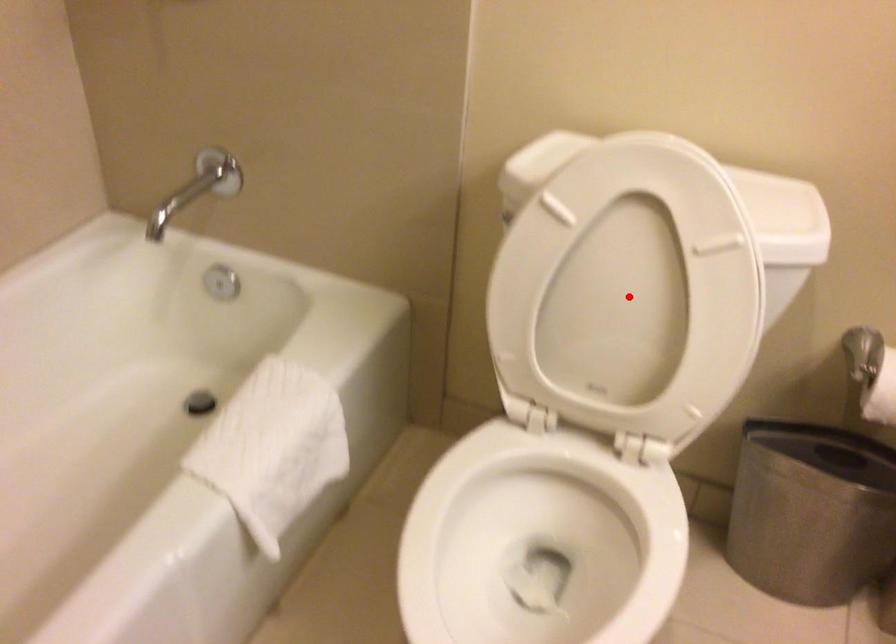
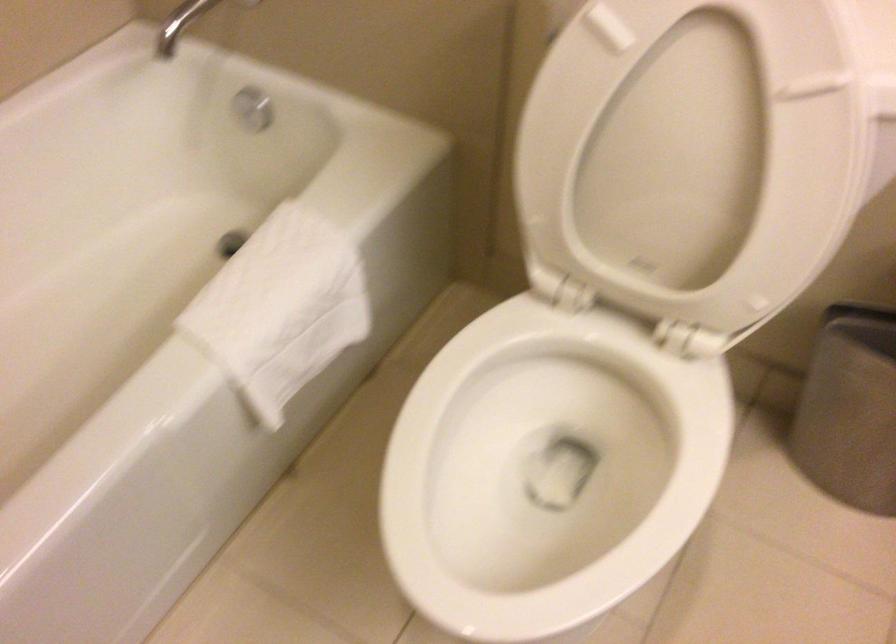
Question: A red point is marked in image1. In image2, is the corresponding 3D point closer to the camera or farther? Reply with the corresponding letter.

Choices:
 (A) The corresponding 3D point is closer.
 (B) The corresponding 3D point is farther.

Answer: (A)